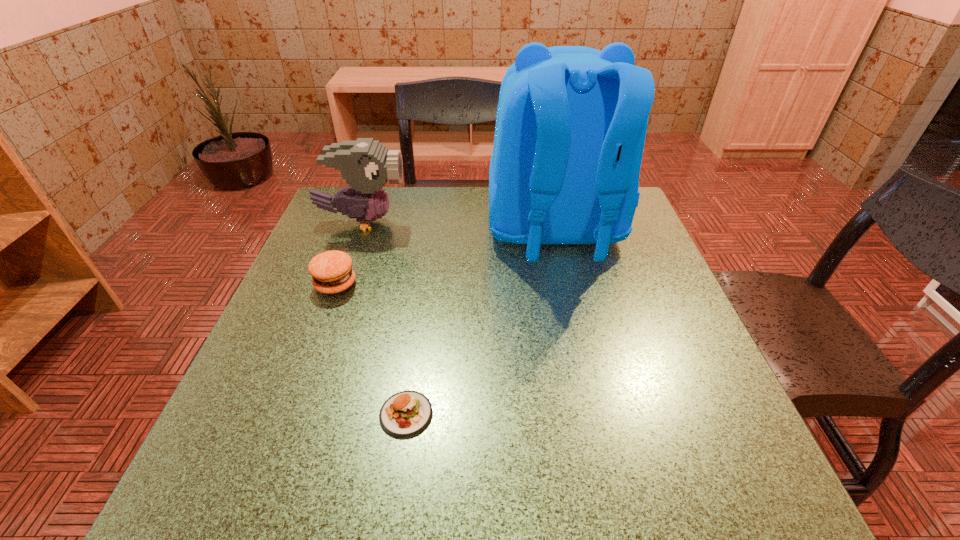
Identify the location of vacant space situated 0.140m on the back of the right patty (food). (419, 330).

This screenshot has height=540, width=960. I want to click on backpack at the far edge, so click(571, 122).

Where is `bird situated at the far edge`? Image resolution: width=960 pixels, height=540 pixels. bird situated at the far edge is located at coordinates (366, 165).

I want to click on bird that is at the left edge, so click(366, 165).

The height and width of the screenshot is (540, 960). Identify the location of patty located in the left edge section of the desktop. (332, 273).

In order to click on object that is positioned at the right edge in this screenshot , I will do `click(571, 122)`.

Find the location of a particular element. The width and height of the screenshot is (960, 540). object at the far left corner is located at coordinates (366, 165).

Find the location of a particular element. object present at the far right corner is located at coordinates (571, 122).

In the image, there is a desktop. At what (x,y) coordinates should I click in order to perform the action: click on free space at the far edge. Please return your answer as a coordinate pair (x, y). Looking at the image, I should click on (487, 212).

Where is `free space at the near edge of the desktop`? The image size is (960, 540). free space at the near edge of the desktop is located at coordinates (417, 468).